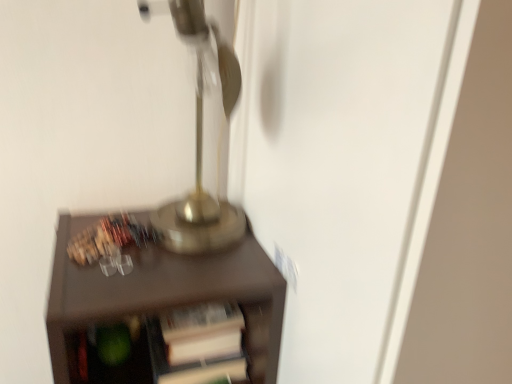
Locate an element on the screen. vacant point above brown matte cabinet at center (from a real-world perspective) is located at coordinates (164, 228).